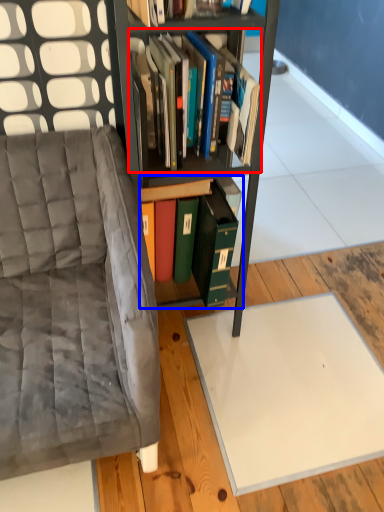
Question: Which object appears farthest to the camera in this image, book (highlighted by a red box) or book (highlighted by a blue box)?

Choices:
 (A) book
 (B) book

Answer: (B)